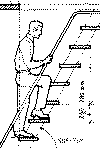
Locate an element on the screen. The image size is (100, 148). stairs is located at coordinates (62, 65), (56, 82), (53, 103), (38, 120), (33, 138).